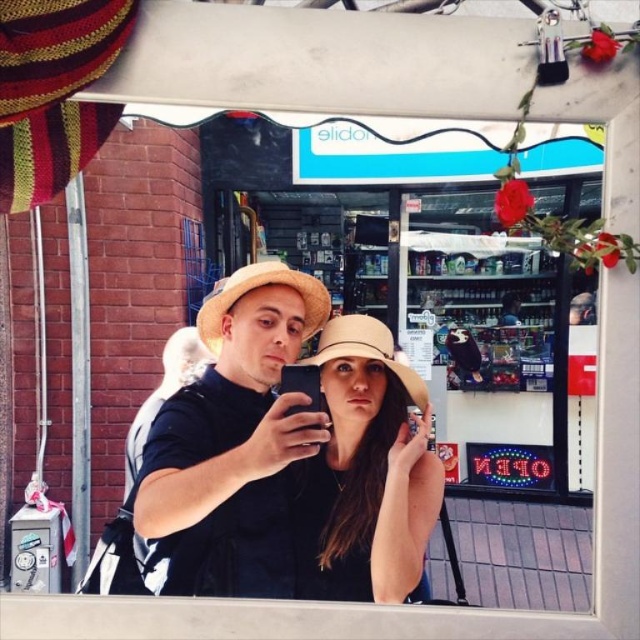
Question: Does matte straw hats at center appear on the right side of beige woven hat at center?

Choices:
 (A) yes
 (B) no

Answer: (B)

Question: Is matte straw hats at center to the left of beige woven hat at center from the viewer's perspective?

Choices:
 (A) no
 (B) yes

Answer: (B)

Question: Which object appears closest to the camera in this image?

Choices:
 (A) beige woven hat at center
 (B) matte straw hats at center

Answer: (B)

Question: Does matte straw hats at center appear on the right side of beige woven hat at center?

Choices:
 (A) no
 (B) yes

Answer: (A)

Question: Which point is farther to the camera?

Choices:
 (A) matte straw hats at center
 (B) beige woven hat at center

Answer: (B)

Question: Among these points, which one is farthest from the camera?

Choices:
 (A) (x=332, y=440)
 (B) (x=253, y=404)

Answer: (A)